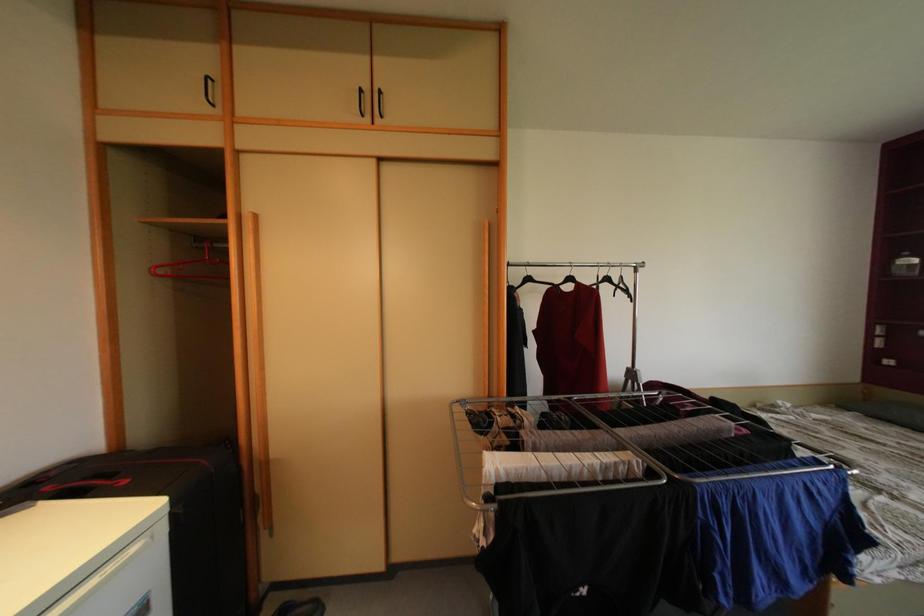
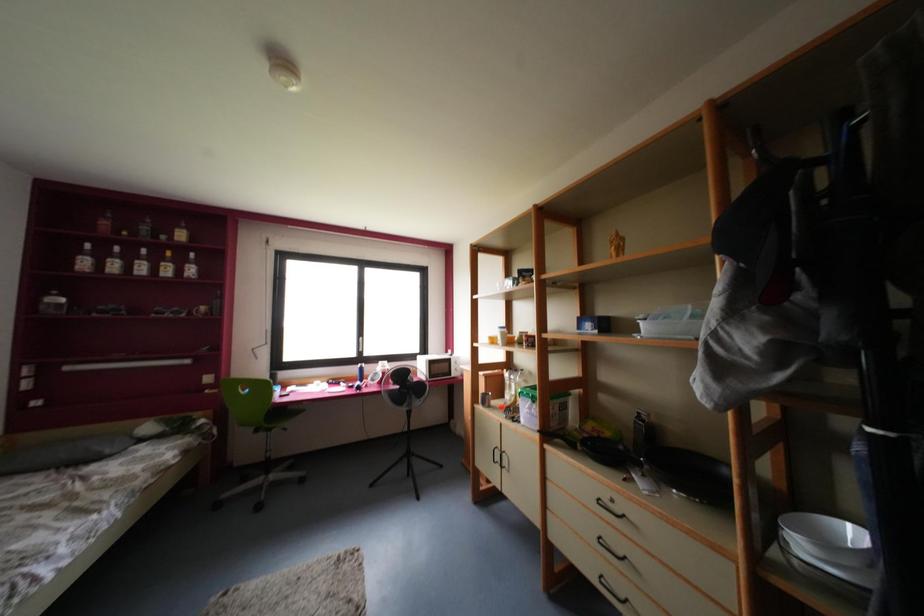
Question: How did the camera likely rotate?

Choices:
 (A) Left
 (B) Right
 (C) Up
 (D) Down

Answer: (B)